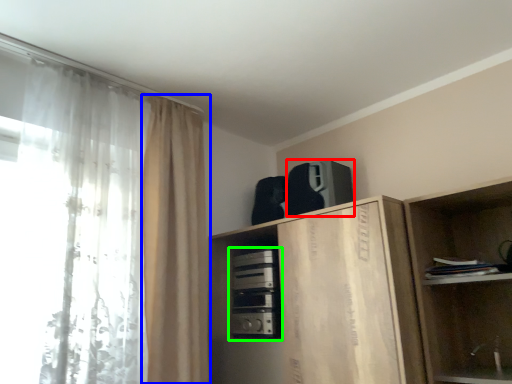
Question: Which object is the closest to the appliance (highlighted by a red box)? Choose among these: curtain (highlighted by a blue box) or appliance (highlighted by a green box).

Choices:
 (A) curtain
 (B) appliance

Answer: (B)